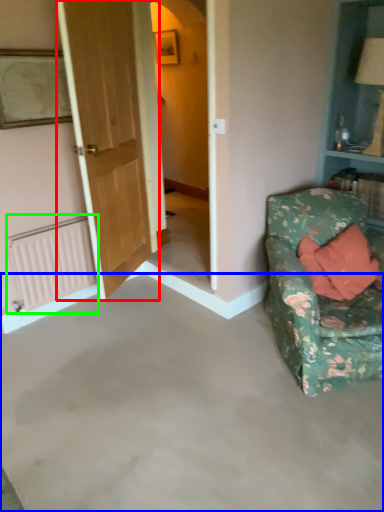
Question: Considering the real-world distances, which object is closest to door (highlighted by a red box)? concrete (highlighted by a blue box) or radiator (highlighted by a green box).

Choices:
 (A) concrete
 (B) radiator

Answer: (B)